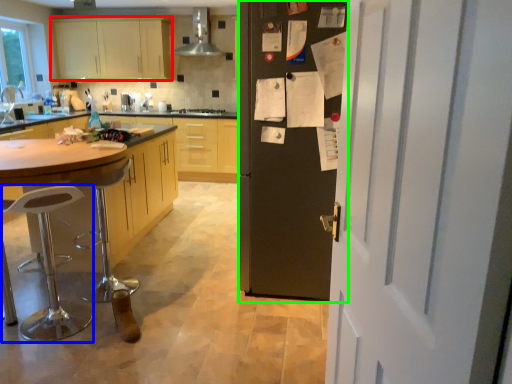
Question: Based on their relative distances, which object is farther from cabinetry (highlighted by a red box)? Choose from bar stool (highlighted by a blue box) and fridge (highlighted by a green box).

Choices:
 (A) bar stool
 (B) fridge

Answer: (B)